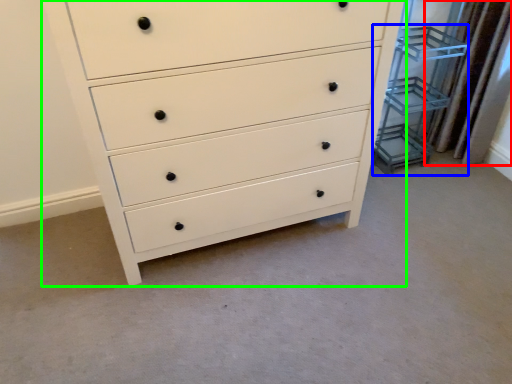
Question: Based on their relative distances, which object is nearer to curtain (highlighted by a red box)? Choose from cabinet (highlighted by a blue box) and chest of drawers (highlighted by a green box).

Choices:
 (A) cabinet
 (B) chest of drawers

Answer: (A)